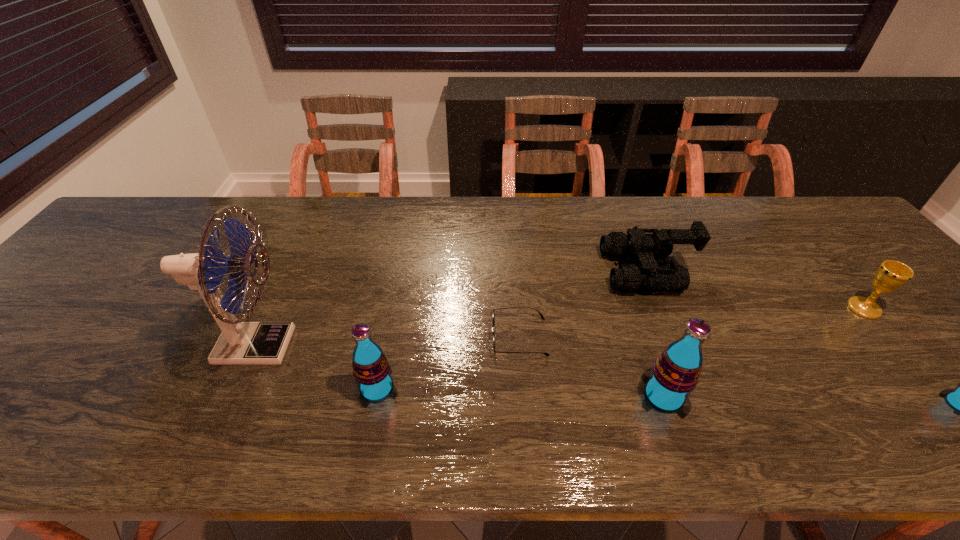
Find the location of `vacant area that lies between the farthest object and the third tallest object`. vacant area that lies between the farthest object and the third tallest object is located at coordinates (512, 330).

The height and width of the screenshot is (540, 960). In order to click on object that is the third closest to the second soda from right to left in this screenshot , I will do `click(371, 369)`.

Locate an element on the screen. the fourth closest object to the leftmost soda is located at coordinates (628, 278).

This screenshot has width=960, height=540. I want to click on soda that is the third closest to the farthest object, so click(371, 369).

Image resolution: width=960 pixels, height=540 pixels. What are the coordinates of `the second closest soda relative to the sixth object from right to left` in the screenshot? It's located at (959, 399).

Where is `vacant position in the image that satisfies the following two spatial constraints: 1. on the front-facing side of the second soda from left to right; 2. on the left side of the shortest object`? vacant position in the image that satisfies the following two spatial constraints: 1. on the front-facing side of the second soda from left to right; 2. on the left side of the shortest object is located at coordinates (524, 396).